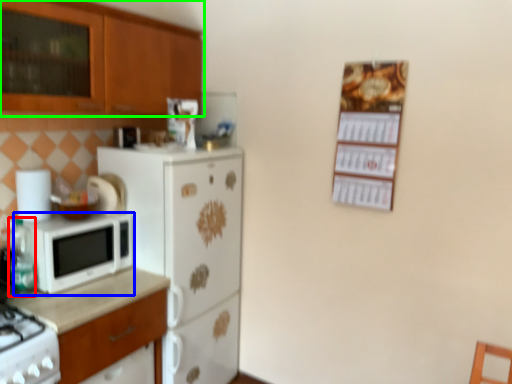
Question: Considering the real-world distances, which object is farthest from bottle (highlighted by a red box)? microwave oven (highlighted by a blue box) or cabinetry (highlighted by a green box)?

Choices:
 (A) microwave oven
 (B) cabinetry

Answer: (B)